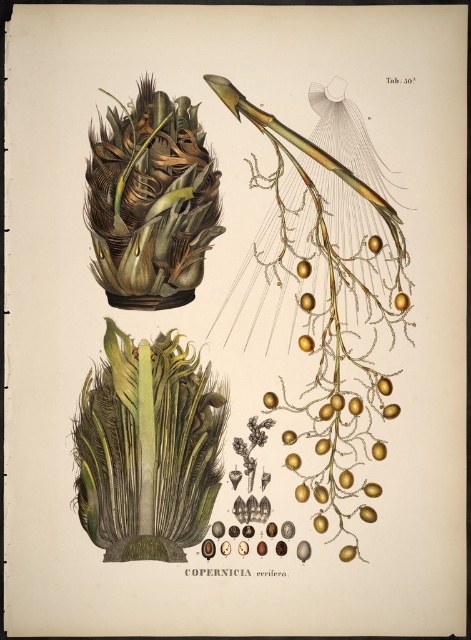
You are an artist examining the botanical illustration of Copernicia cerifera. You notice two fruits labeled as golden matte fruit at right and golden glossy fruit at upper right. Which of these fruits has a greater width?

The golden glossy fruit at upper right is wider than the golden matte fruit at right.

In the botanical illustration of the Copernicia cerifera plant, you see a green leafy plant at center and a brown fibrous plant at upper left. Which of these two plants is positioned to the right side of the other?

The green leafy plant at center is to the left of the brown fibrous plant at upper left, so the brown fibrous plant at upper left is positioned to the right of the green leafy plant at center.